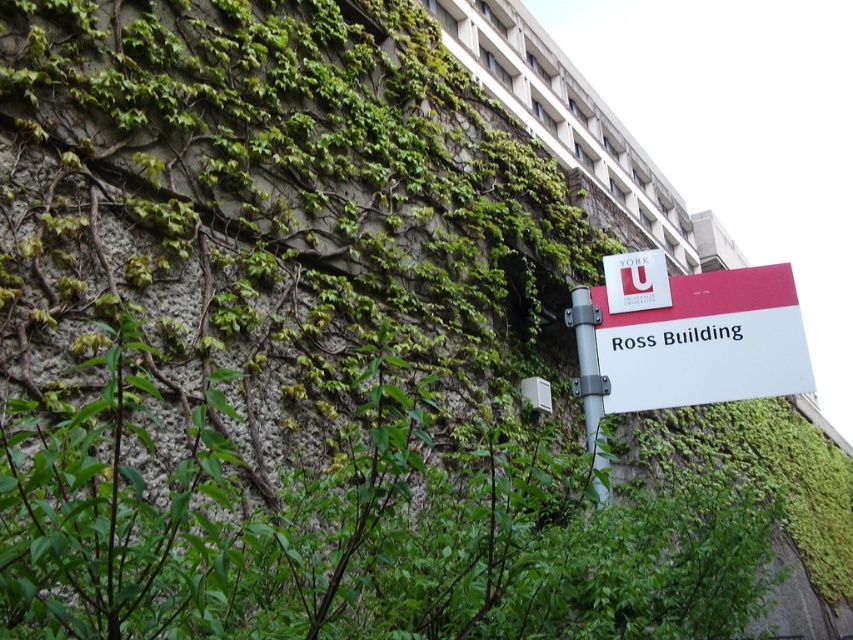
Question: Which of the following is the farthest from the observer?

Choices:
 (A) (660, 301)
 (B) (642, 381)

Answer: (A)

Question: Which of the following is the farthest from the observer?

Choices:
 (A) (616, 305)
 (B) (757, 289)

Answer: (A)

Question: Can you confirm if white plastic sign at lower right is smaller than silver metallic pole at upper center?

Choices:
 (A) no
 (B) yes

Answer: (A)

Question: In this image, where is silver metallic pole at upper center located relative to matte red sign at center?

Choices:
 (A) above
 (B) below

Answer: (B)

Question: Which object appears farthest from the camera in this image?

Choices:
 (A) matte red sign at center
 (B) white plastic sign at lower right

Answer: (A)

Question: Can you confirm if silver metallic pole at upper center is positioned to the right of matte red sign at center?

Choices:
 (A) yes
 (B) no

Answer: (B)